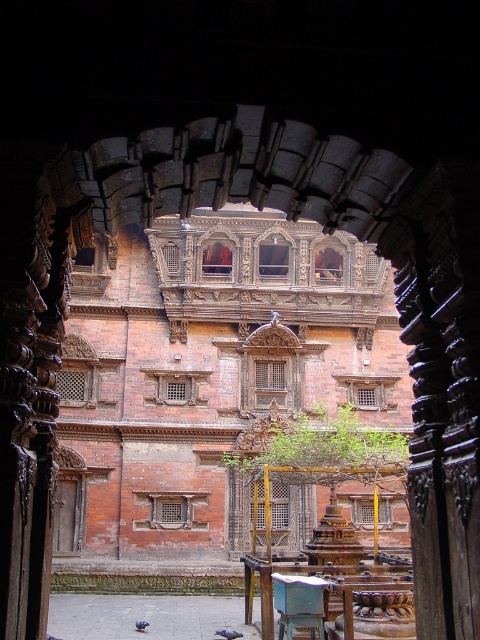
You are standing in the courtyard looking through the carved wooden archway. You see a gray feathered pigeon at center and a blue feathered pigeon at center. Which pigeon is more to the right?

The gray feathered pigeon at center is more to the right.

You are standing in front of the carved wooden archway and see a point marked at coordinates (210, 371). According to the scene description, where is this point located?

The point is located on the brown brick palace at center.

You are an architect analyzing the spatial relationship between the brown brick palace at center and the blue feathered pigeon at center. Which object occupies more space in the image?

The brown brick palace at center is larger in size than the blue feathered pigeon at center, so it occupies more space in the image.